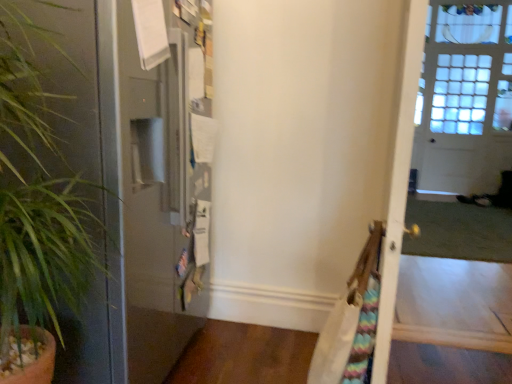
Question: From the image's perspective, relative to green leafy plant at left, is clear glass screen door at right above or below?

Choices:
 (A) above
 (B) below

Answer: (A)

Question: In terms of size, does clear glass screen door at right appear bigger or smaller than green leafy plant at left?

Choices:
 (A) big
 (B) small

Answer: (A)

Question: Is clear glass screen door at right inside or outside of green leafy plant at left?

Choices:
 (A) outside
 (B) inside

Answer: (A)

Question: Is green leafy plant at left to the left or to the right of clear glass screen door at right in the image?

Choices:
 (A) right
 (B) left

Answer: (B)

Question: From a real-world perspective, relative to clear glass screen door at right, is green leafy plant at left vertically above or below?

Choices:
 (A) above
 (B) below

Answer: (B)

Question: Considering the positions of point (82, 367) and point (412, 332), is point (82, 367) closer or farther from the camera than point (412, 332)?

Choices:
 (A) farther
 (B) closer

Answer: (B)

Question: Looking at the image, does green leafy plant at left seem bigger or smaller compared to clear glass screen door at right?

Choices:
 (A) small
 (B) big

Answer: (A)